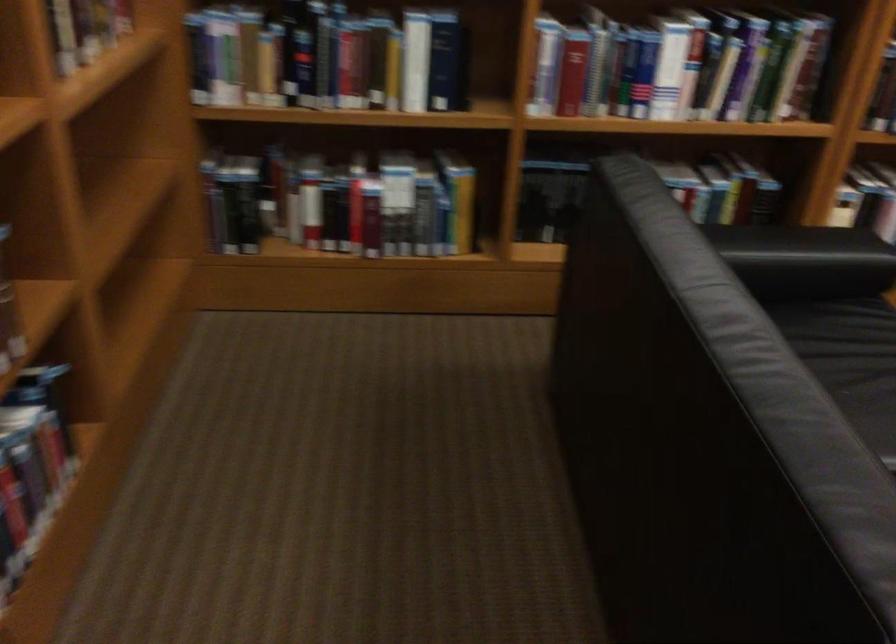
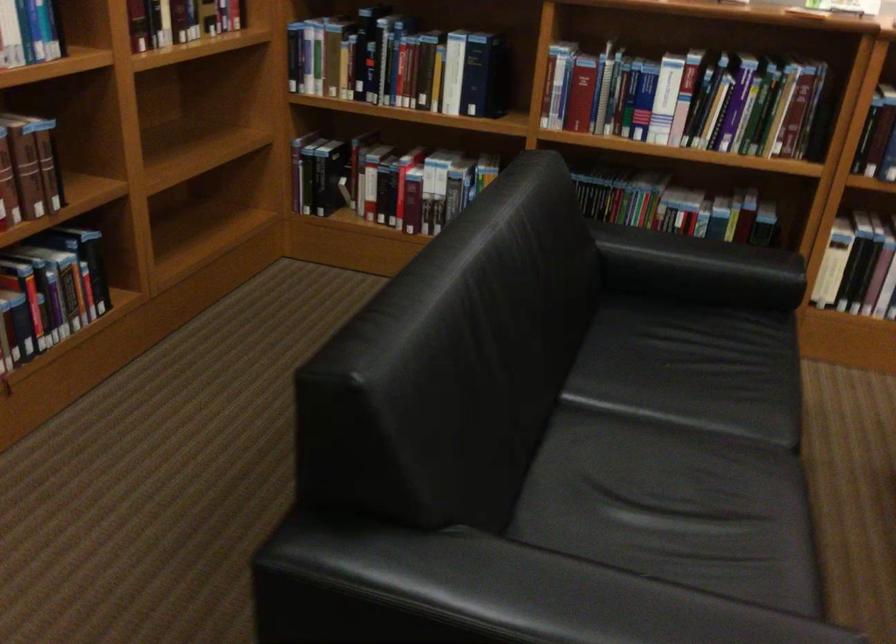
The point at (336, 200) is marked in the first image. Where is the corresponding point in the second image?

(385, 182)